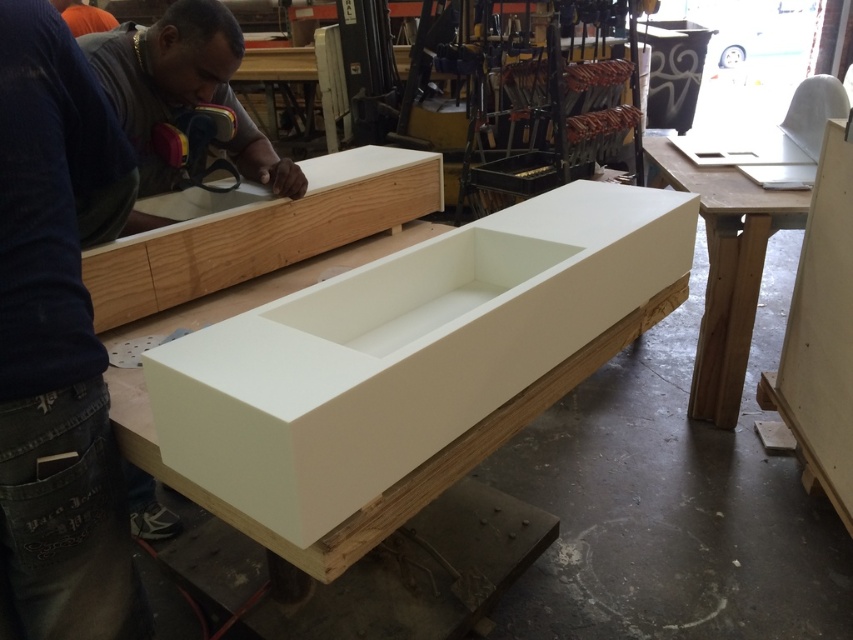
Between point (236, 362) and point (148, 285), which one is positioned in front?

Point (236, 362) is in front.

Is point (265, 349) more distant than point (335, 193)?

No, (265, 349) is closer to viewer.

Identify the location of white matte plywood at center. The image size is (853, 640). (405, 352).

Does point (268, 220) come in front of point (751, 184)?

Yes, point (268, 220) is closer to viewer.

This screenshot has height=640, width=853. I want to click on natural wood plywood at center, so click(x=257, y=230).

Where is `natural wood plywood at center`? This screenshot has height=640, width=853. natural wood plywood at center is located at coordinates (257, 230).

Between white matte plywood at center and white matte wood workbench at center, which one appears on the left side from the viewer's perspective?

white matte plywood at center

Does white matte plywood at center appear on the right side of white matte wood workbench at center?

In fact, white matte plywood at center is to the left of white matte wood workbench at center.

The image size is (853, 640). In order to click on white matte plywood at center in this screenshot , I will do 405,352.